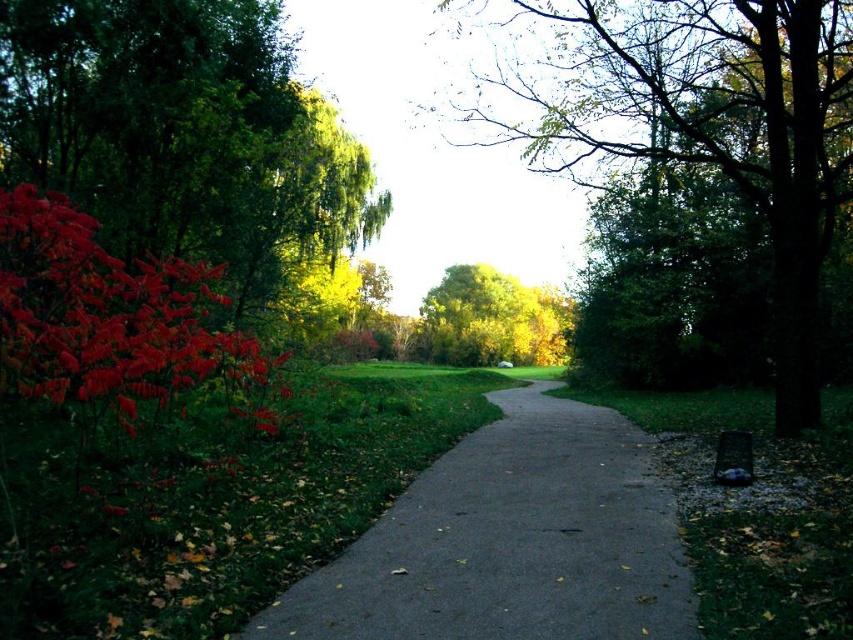
The width and height of the screenshot is (853, 640). What are the coordinates of `green leafy tree at center` in the screenshot? It's located at (688, 122).

Is green leafy tree at center positioned before glossy red leaves at left?

No, green leafy tree at center is further to the viewer.

Is point (654, 112) closer to viewer compared to point (44, 326)?

No.

Image resolution: width=853 pixels, height=640 pixels. I want to click on green leafy tree at center, so click(688, 122).

The image size is (853, 640). Describe the element at coordinates (184, 134) in the screenshot. I see `vivid red leaves at left` at that location.

Is vivid red leaves at left wider than yellow-green leafy tree at center?

No.

You are a GUI agent. You are given a task and a screenshot of the screen. Output one action in this format:
    pyautogui.click(x=<x>, y=<y>)
    Task: Click on the vivid red leaves at left
    The width and height of the screenshot is (853, 640).
    Given the screenshot: What is the action you would take?
    pyautogui.click(x=184, y=134)

Image resolution: width=853 pixels, height=640 pixels. Find the location of `vivid red leaves at left`. vivid red leaves at left is located at coordinates (184, 134).

Does asphalt path at center have a greater height compared to yellow-green leafy tree at center?

No, asphalt path at center is not taller than yellow-green leafy tree at center.

Does asphalt path at center appear over yellow-green leafy tree at center?

Incorrect, asphalt path at center is not positioned above yellow-green leafy tree at center.

Between point (524, 561) and point (494, 298), which one is positioned behind?

Point (494, 298)

This screenshot has width=853, height=640. I want to click on asphalt path at center, so click(511, 541).